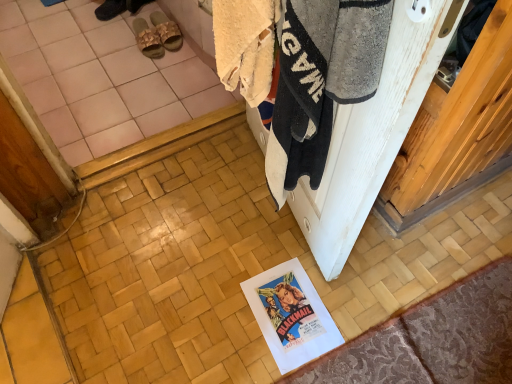
Identify the location of free location to the left of white paper at lower center. This screenshot has height=384, width=512. (217, 312).